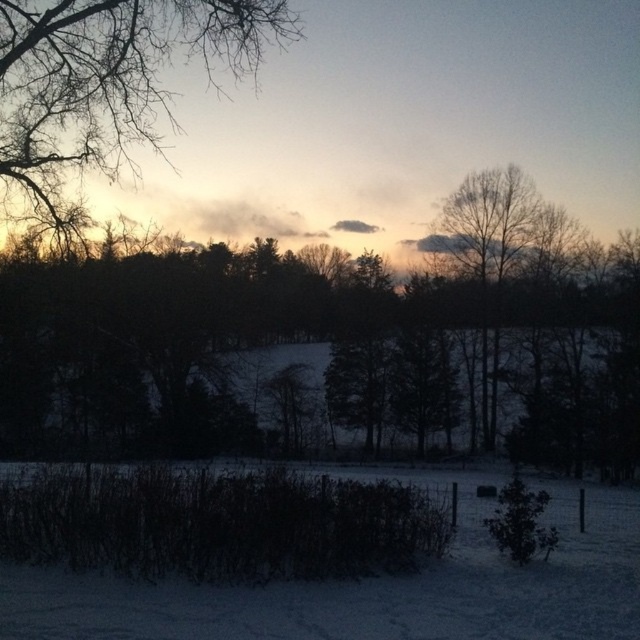
You are an artist painting this winter scene. You want to ensure the white powdery snow at lower center and the bare branches at upper left are proportionally accurate. Which object should you make wider in your painting?

The white powdery snow at lower center should be made wider in the painting since its width is larger than the bare branches at upper left according to the description.

You are standing at the point marked as point (371, 589) in the winter landscape. What surface are you standing on?

The point (371, 589) is on white powdery snow at lower center, so you are standing on white powdery snow at lower center.

You are standing in the winter landscape and want to walk from point A to point B. Point A is at coordinate point point (308,588) and point B is at coordinate point point (12,124). Which point is closer to you when you start at point A?

Point A at coordinate point (308,588) is closer to you because it is your starting position.